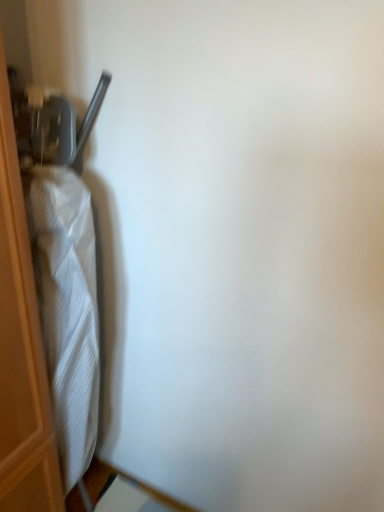
What do you see at coordinates (21, 348) in the screenshot?
I see `white fabric chair at left` at bounding box center [21, 348].

Locate an element on the screen. Image resolution: width=384 pixels, height=512 pixels. white fabric chair at left is located at coordinates (21, 348).

What are the coordinates of `white fabric chair at left` in the screenshot? It's located at tap(21, 348).